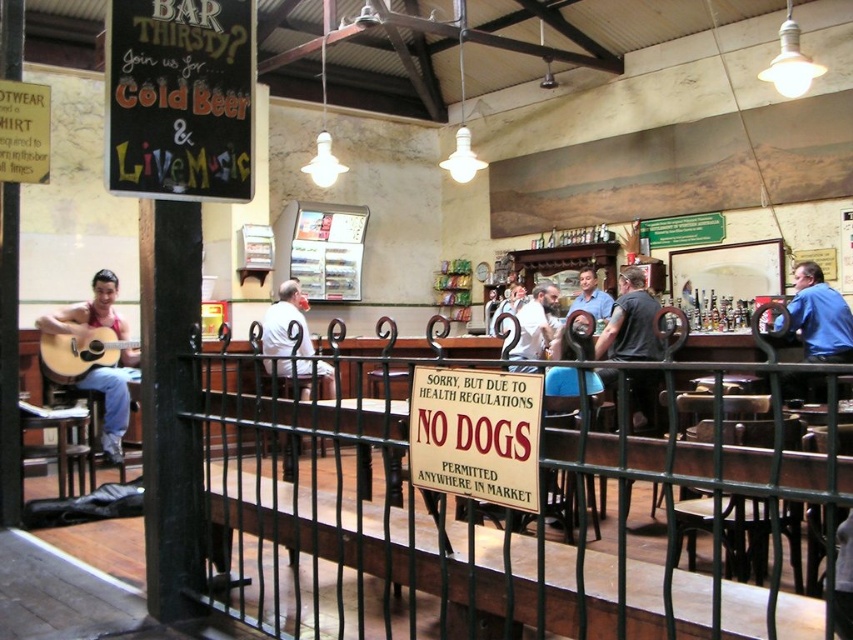
Question: Which object is closer to the camera taking this photo?

Choices:
 (A) red plastic sign at center
 (B) light brown leather jacket at center
 (C) acoustic wood guitar at left
 (D) blue shirt at right

Answer: (A)

Question: Does blue shirt at right have a larger size compared to light brown leather jacket at center?

Choices:
 (A) yes
 (B) no

Answer: (A)

Question: Which point is farther to the camera?

Choices:
 (A) red plastic sign at center
 (B) acoustic wood guitar at left
 (C) blue shirt at right

Answer: (B)

Question: Is blue shirt at right further to the viewer compared to acoustic wood guitar at left?

Choices:
 (A) yes
 (B) no

Answer: (B)

Question: Considering the relative positions of blue shirt at right and black t-shirt at center in the image provided, where is blue shirt at right located with respect to black t-shirt at center?

Choices:
 (A) above
 (B) below

Answer: (B)

Question: Which of the following is the farthest from the observer?

Choices:
 (A) (512, 506)
 (B) (776, 637)
 (C) (80, 369)

Answer: (C)